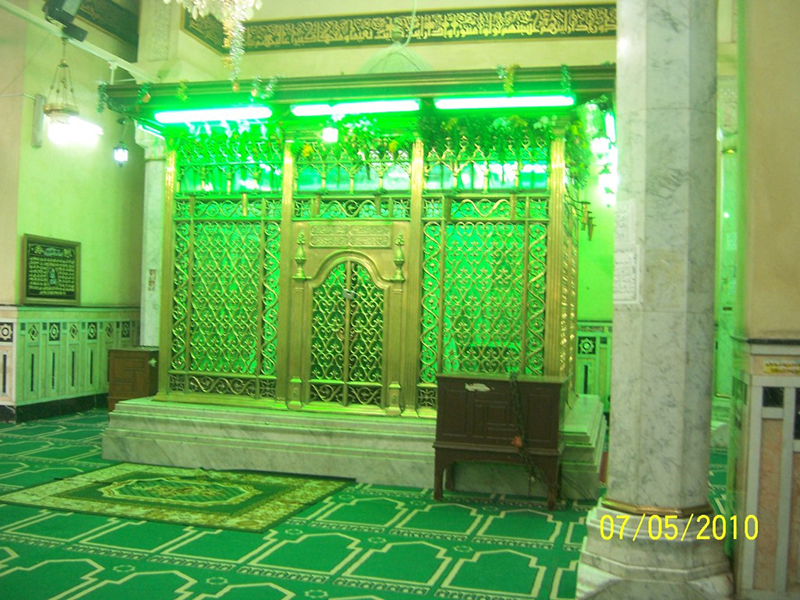
You are a GUI agent. You are given a task and a screenshot of the screen. Output one action in this format:
    pyautogui.click(x=<x>, y=<y>)
    Task: Click on the cabinet
    This screenshot has width=800, height=600.
    Given the screenshot: What is the action you would take?
    pyautogui.click(x=518, y=423), pyautogui.click(x=128, y=365)